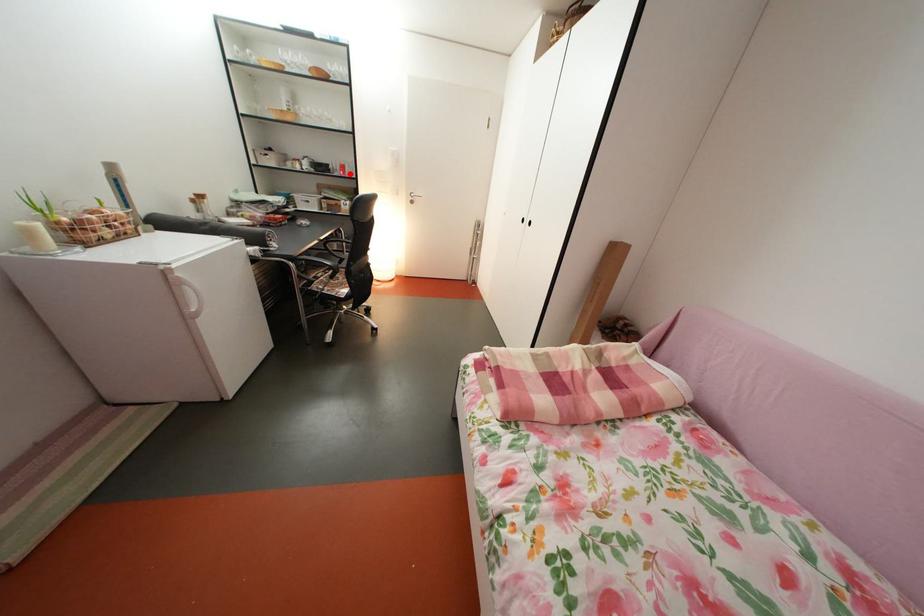
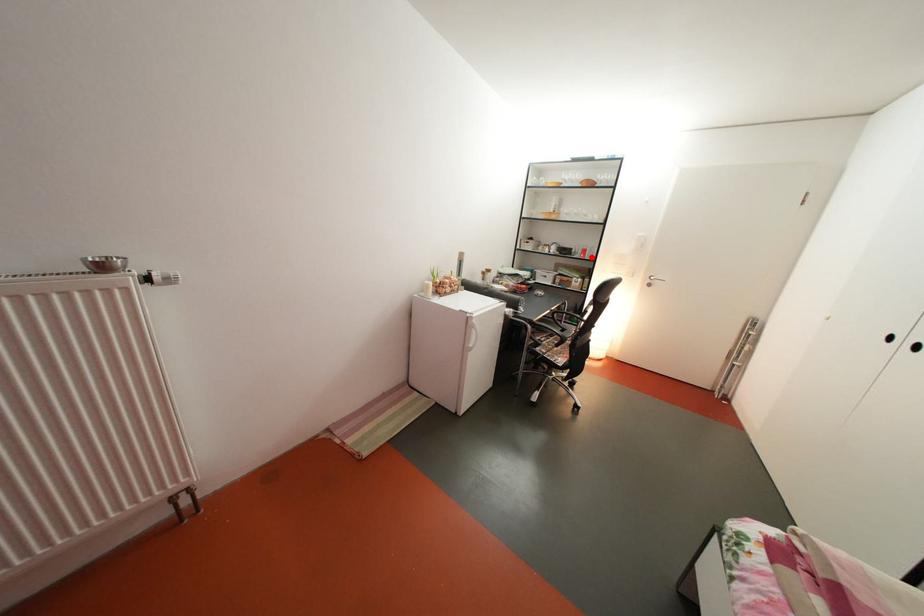
I am providing you with two images of the same scene from different viewpoints. A red point is marked on the first image and another point is marked on the second image. Are the points marked in image1 and image2 representing the same 3D position?

Yes